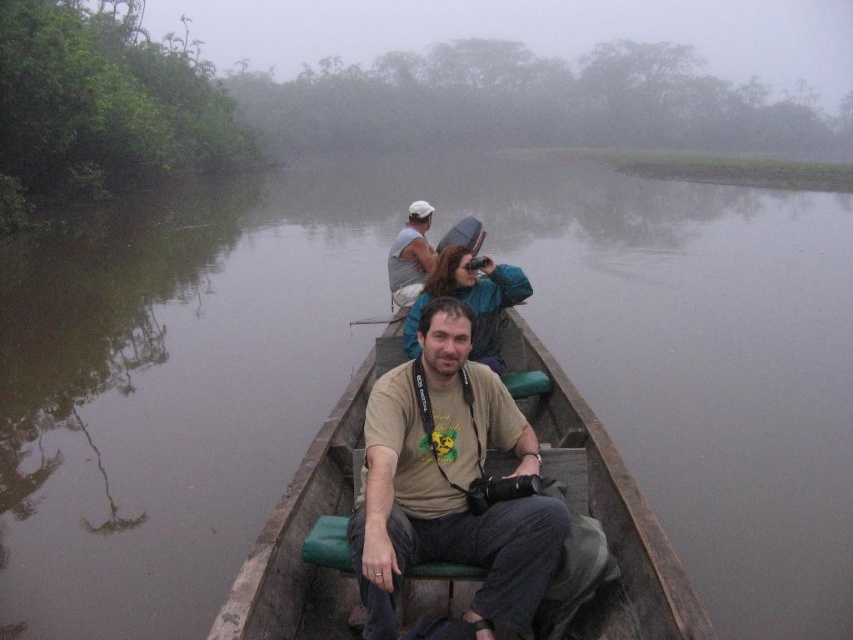
Question: Which point is farther to the camera?

Choices:
 (A) (473, 298)
 (B) (393, 298)

Answer: (B)

Question: Which object appears farthest from the camera in this image?

Choices:
 (A) wooden canoe at center
 (B) matte gray shirt at upper center

Answer: (B)

Question: Among these points, which one is nearest to the camera?

Choices:
 (A) (392, 264)
 (B) (379, 481)

Answer: (B)

Question: Is wooden canoe at center closer to camera compared to matte khaki t-shirt at center?

Choices:
 (A) no
 (B) yes

Answer: (A)

Question: Is wooden canoe at center below matte gray shirt at upper center?

Choices:
 (A) no
 (B) yes

Answer: (B)

Question: Can you confirm if wooden canoe at center is positioned to the left of matte khaki t-shirt at center?

Choices:
 (A) no
 (B) yes

Answer: (A)